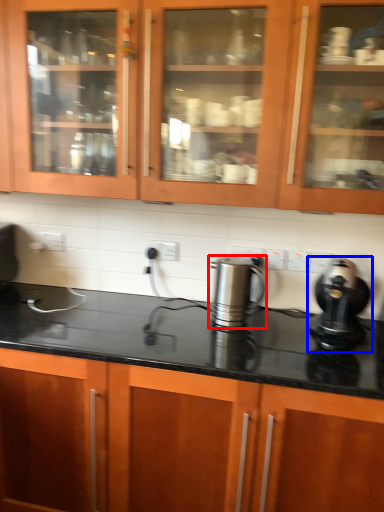
Question: Which object appears closest to the camera in this image, kitchen appliance (highlighted by a red box) or home appliance (highlighted by a blue box)?

Choices:
 (A) kitchen appliance
 (B) home appliance

Answer: (B)